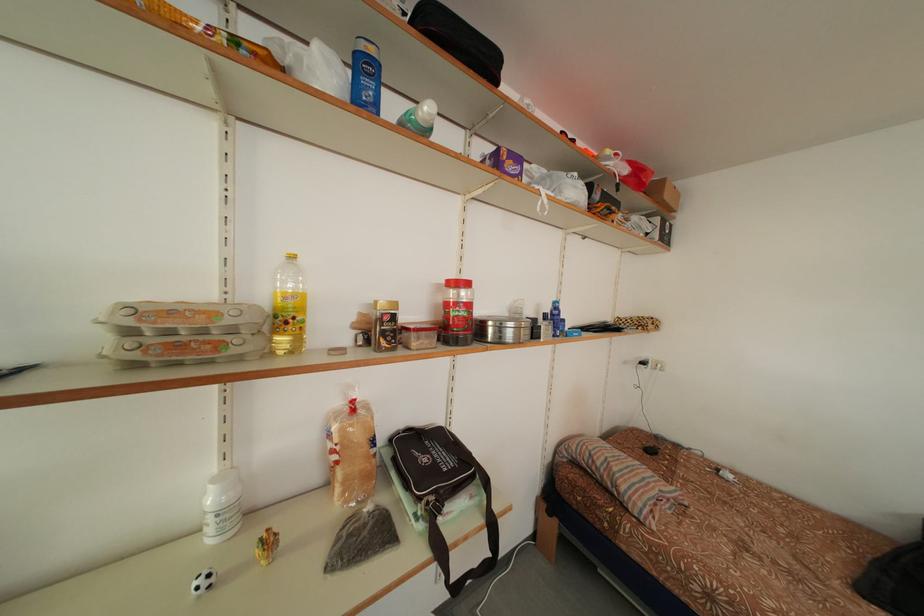
What do you see at coordinates (288, 307) in the screenshot? This screenshot has height=616, width=924. I see `the yellow oil bottle` at bounding box center [288, 307].